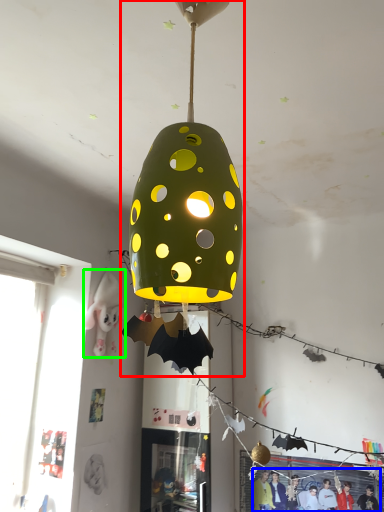
Question: Which object is positioned farthest from lamp (highlighted by a red box)? Select from person (highlighted by a blue box) and person (highlighted by a green box).

Choices:
 (A) person
 (B) person

Answer: (A)